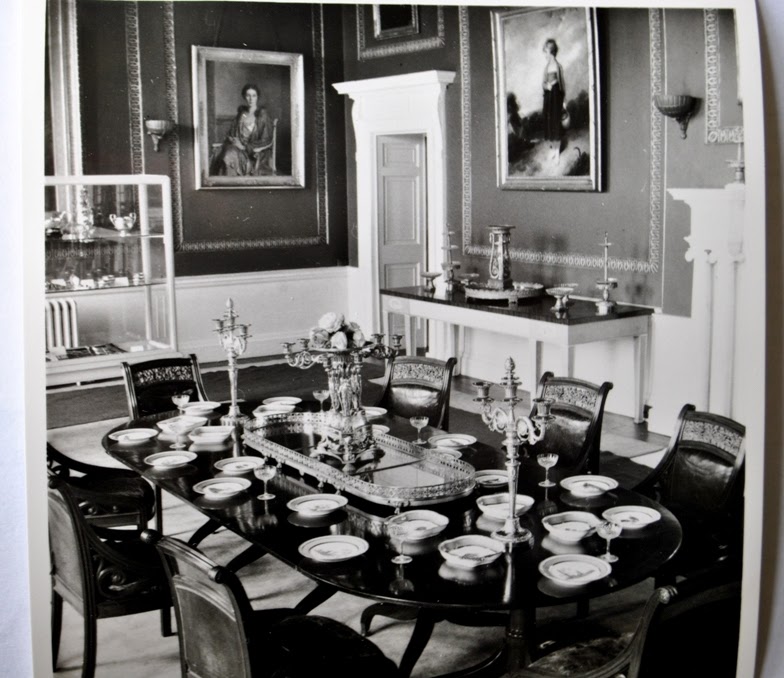
Find the location of a particular element. The width and height of the screenshot is (784, 678). mantlepiece is located at coordinates (721, 212).